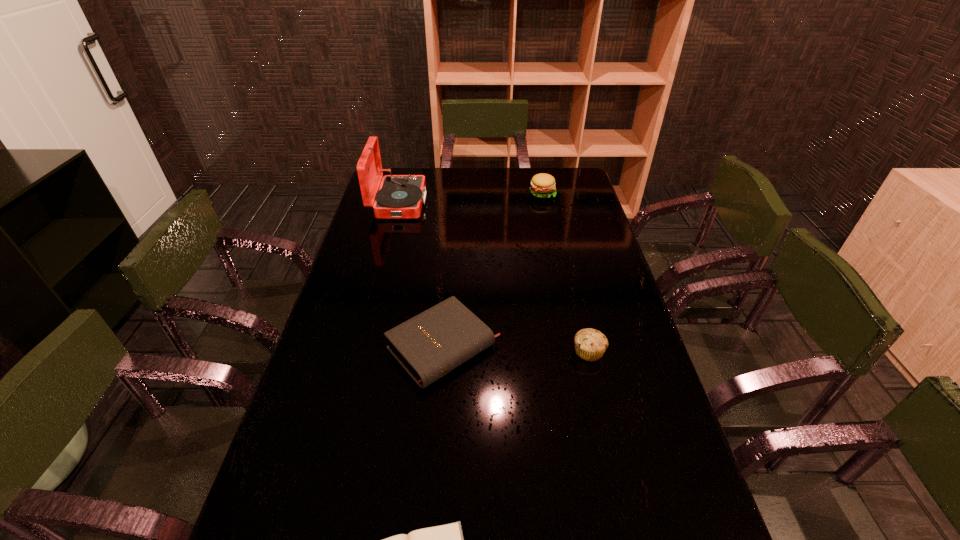
You are a GUI agent. You are given a task and a screenshot of the screen. Output one action in this format:
    pyautogui.click(x=<x>, y=<y>)
    Task: Click on the tallest object
    The width and height of the screenshot is (960, 540).
    Given the screenshot: What is the action you would take?
    pyautogui.click(x=400, y=196)

Identify the location of hamburger. This screenshot has height=540, width=960. (543, 185).

What are the coordinates of `muffin` in the screenshot? It's located at (590, 344).

The width and height of the screenshot is (960, 540). In order to click on the farther Bible in this screenshot , I will do `click(433, 343)`.

Identify the location of the fourth tallest object. (433, 343).

Where is `vacant area situated 0.210m on the front-facing side of the tallest object`? The image size is (960, 540). vacant area situated 0.210m on the front-facing side of the tallest object is located at coordinates (477, 203).

Image resolution: width=960 pixels, height=540 pixels. What are the coordinates of `free space located on the left of the hamburger` in the screenshot? It's located at (480, 193).

The width and height of the screenshot is (960, 540). Find the location of `blank space located on the front of the muffin`. blank space located on the front of the muffin is located at coordinates (599, 396).

At what (x,y) coordinates should I click in order to perform the action: click on free space located on the back of the farther Bible. Please return your answer as a coordinate pair (x, y). This screenshot has height=540, width=960. Looking at the image, I should click on (449, 282).

Where is `phonograph_record present at the far edge`? phonograph_record present at the far edge is located at coordinates (400, 196).